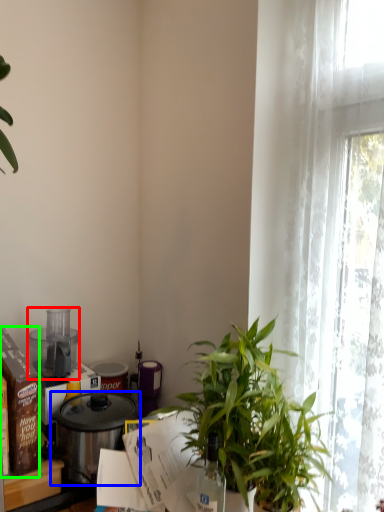
Question: Which object is positioned farthest from kitchen appliance (highlighted by a red box)? Select from pot/pan (highlighted by a blue box) and box (highlighted by a green box).

Choices:
 (A) pot/pan
 (B) box

Answer: (B)